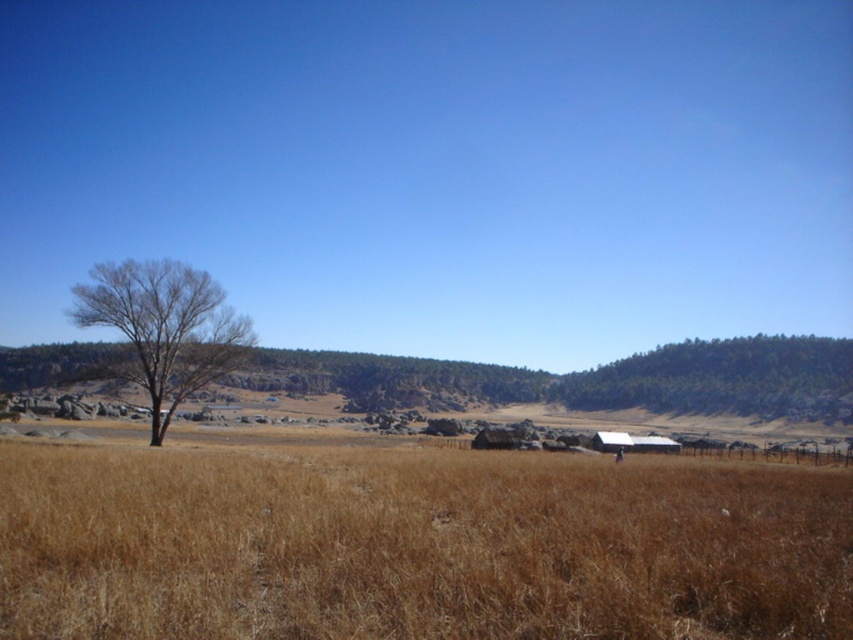
Can you confirm if brown dry grass at center is wider than bare wood tree at left?

Yes.

Is point (404, 493) closer to viewer compared to point (204, 316)?

Yes, it is.

You are a GUI agent. You are given a task and a screenshot of the screen. Output one action in this format:
    pyautogui.click(x=<x>, y=<y>)
    Task: Click on the brown dry grass at center
    The width and height of the screenshot is (853, 640).
    Given the screenshot: What is the action you would take?
    coord(416,547)